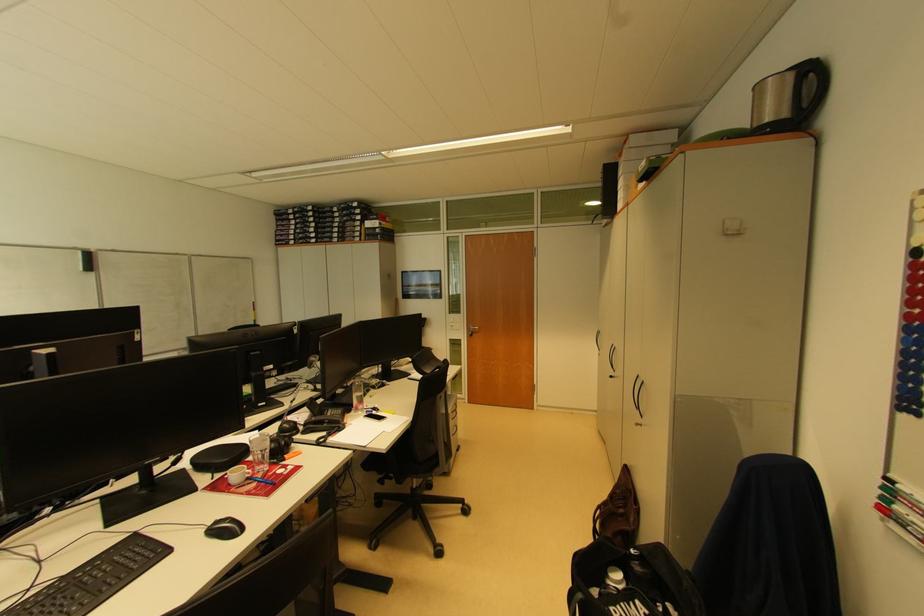
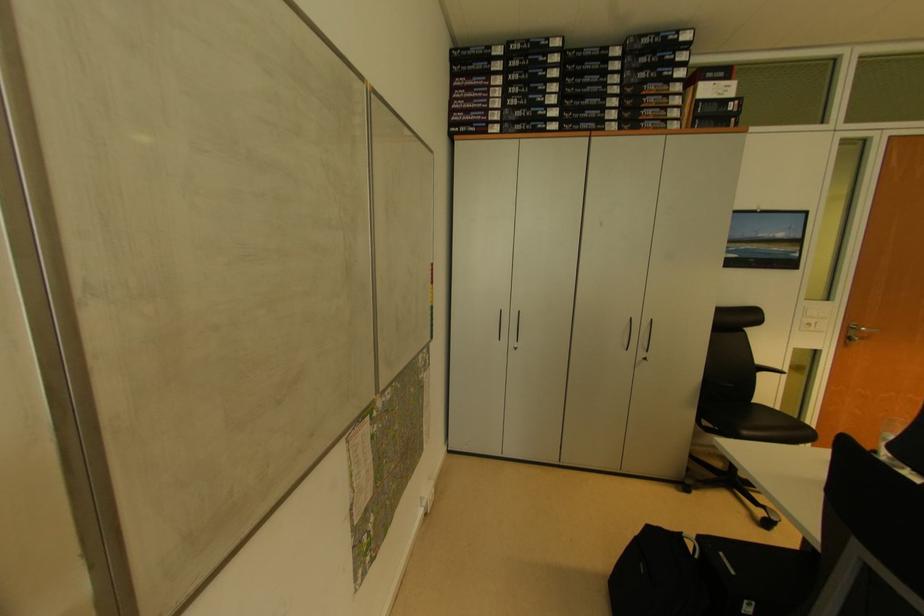
What movement of the cameraman would produce the second image?

The movement direction of the cameraman is left, forward.